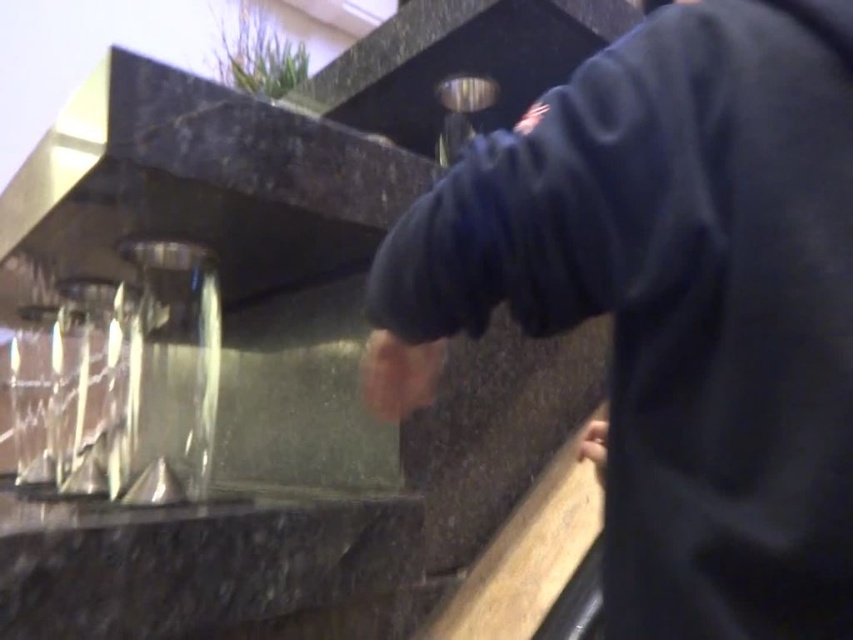
Question: Is dark blue sweatshirt at center wider than black marble counter at lower left?

Choices:
 (A) no
 (B) yes

Answer: (A)

Question: Is dark blue sweatshirt at center positioned at the back of black marble counter at lower left?

Choices:
 (A) yes
 (B) no

Answer: (B)

Question: Is dark blue sweatshirt at center to the left of black marble counter at lower left from the viewer's perspective?

Choices:
 (A) yes
 (B) no

Answer: (B)

Question: Which point is farther from the camera taking this photo?

Choices:
 (A) (376, 576)
 (B) (828, 262)

Answer: (A)

Question: Which of the following is the farthest from the observer?

Choices:
 (A) (712, 260)
 (B) (204, 564)

Answer: (B)